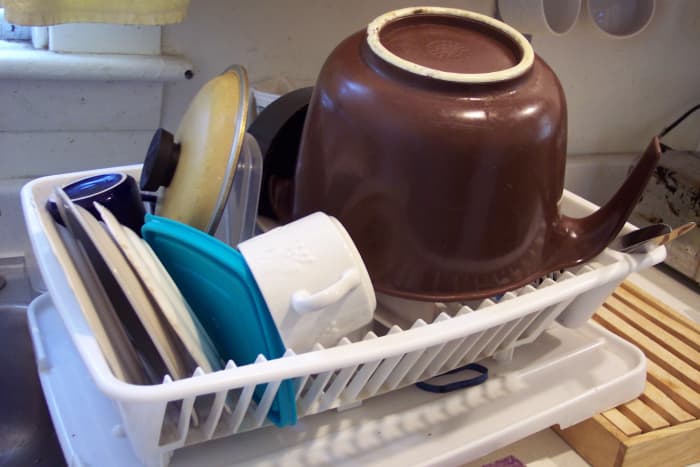
Where is `jug`? The image size is (700, 467). jug is located at coordinates (467, 174).